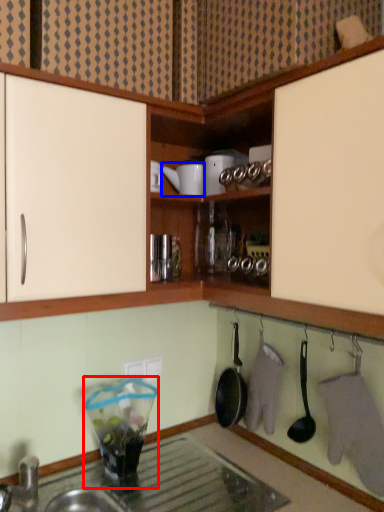
Question: Which object appears closest to the camera in this image, appliance (highlighted by a red box) or appliance (highlighted by a blue box)?

Choices:
 (A) appliance
 (B) appliance

Answer: (A)